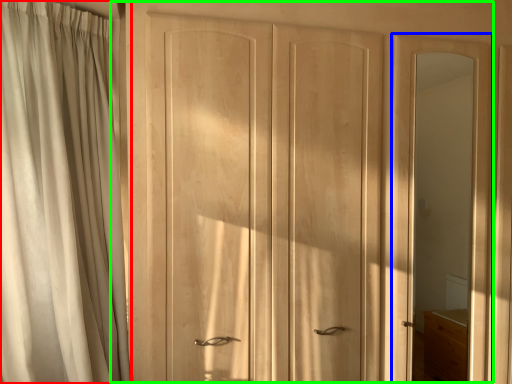
Question: Which is nearer to the curtain (highlighted by a red box)? screen door (highlighted by a blue box) or door (highlighted by a green box).

Choices:
 (A) screen door
 (B) door

Answer: (B)